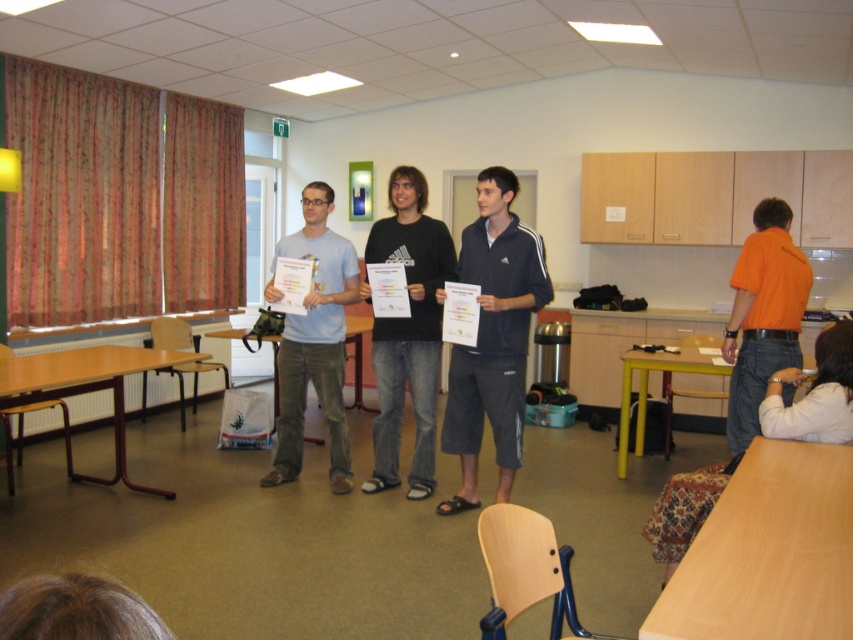
Based on the photo, you are a photographer in the classroom and want to take a photo of the orange cotton shirt at right and the black cotton shirt at center. Which one is closer to the camera?

The black cotton shirt at center is closer to the camera because the orange cotton shirt at right is behind it.

What are the coordinates of the dark blue athletic shorts at center?

The dark blue athletic shorts at center are located at coordinates point (492, 337).